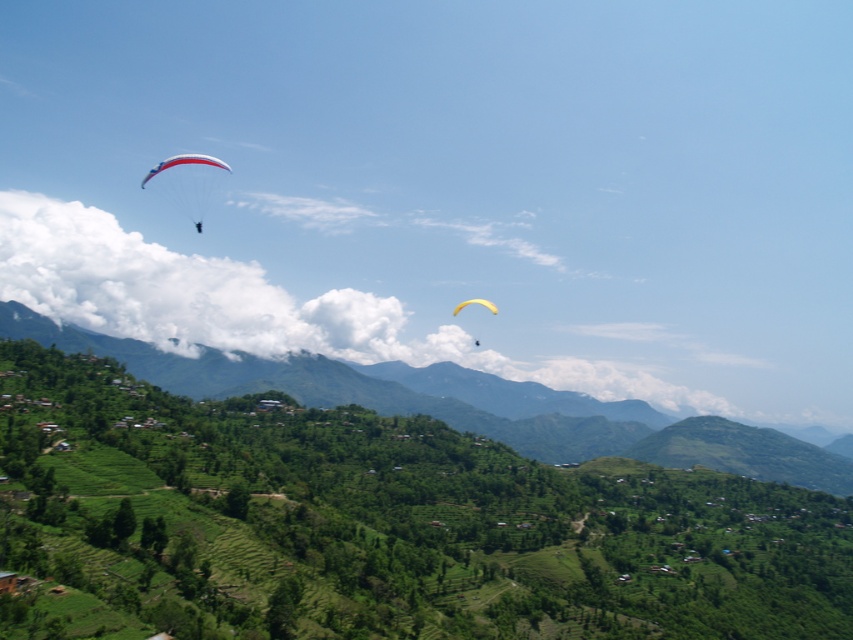
You are a hiker standing on the mountain path. You see the green terraced field at center and the yellow matte parachute at upper center. Which object is positioned to the left of the other?

The green terraced field at center is to the left of the yellow matte parachute at upper center.